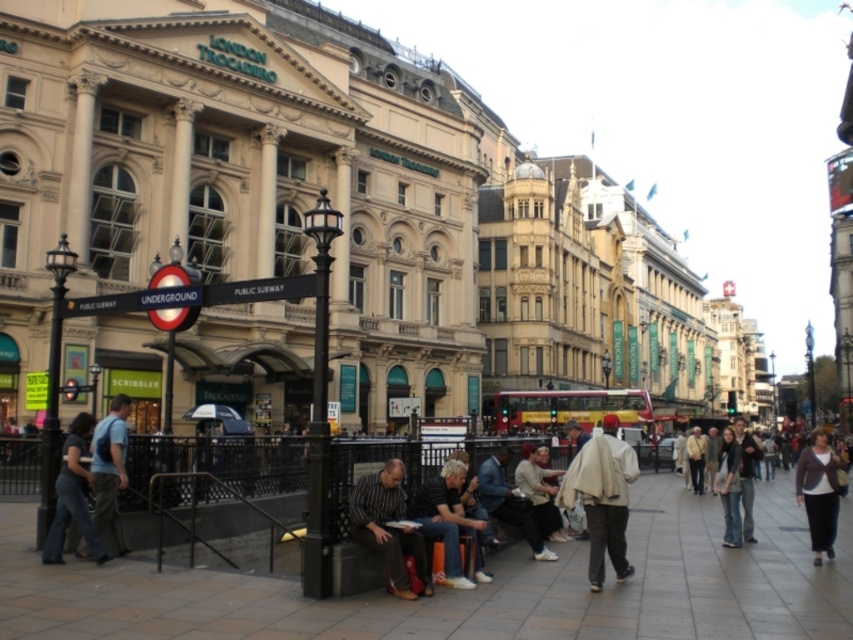
Can you confirm if white woolen coat at center is positioned to the left of dark gray fabric jacket at center?

No, white woolen coat at center is not to the left of dark gray fabric jacket at center.

Describe the element at coordinates (602, 499) in the screenshot. Image resolution: width=853 pixels, height=640 pixels. I see `white woolen coat at center` at that location.

Where is `white woolen coat at center`? This screenshot has height=640, width=853. white woolen coat at center is located at coordinates (602, 499).

Who is shorter, dark gray fabric jacket at center or dark brown sweater at lower right?

dark gray fabric jacket at center

Is dark gray fabric jacket at center behind dark brown sweater at lower right?

That is False.

Between point (450, 568) and point (822, 493), which one is positioned in front?

Point (450, 568) is more forward.

Locate an element on the screen. The width and height of the screenshot is (853, 640). dark gray fabric jacket at center is located at coordinates (448, 522).

Is paved stone sidewalk at center positioned behind dark brown sweater at lower right?

No, it is not.

Who is more distant from viewer, (x=439, y=588) or (x=836, y=481)?

The point (x=836, y=481) is more distant.

Where is `paved stone sidewalk at center`? paved stone sidewalk at center is located at coordinates (476, 588).